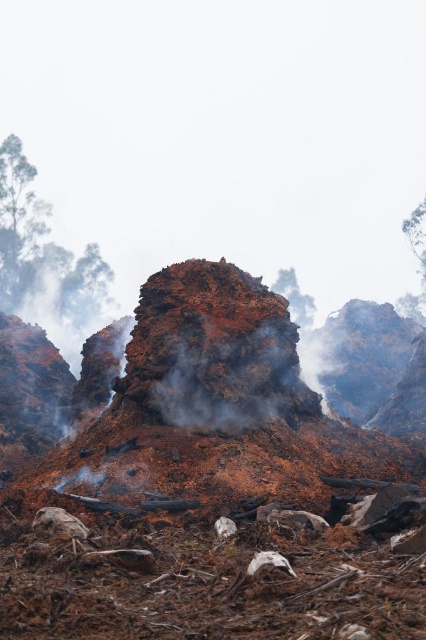
You are a firefighter assessing the wildfire damage. You notice a rusty metallic rock at center and a green leafy tree at left. Which object is nearer to you as you stand at the scene?

The rusty metallic rock at center is closer to the viewer than the green leafy tree at left, so the rusty metallic rock at center is nearer to you.

You are a firefighter assessing the damage after a wildfire. You notice a rusty metallic rock at center and a green leafy tree at left. Which object has a smaller width?

The rusty metallic rock at center has a smaller width than the green leafy tree at left.